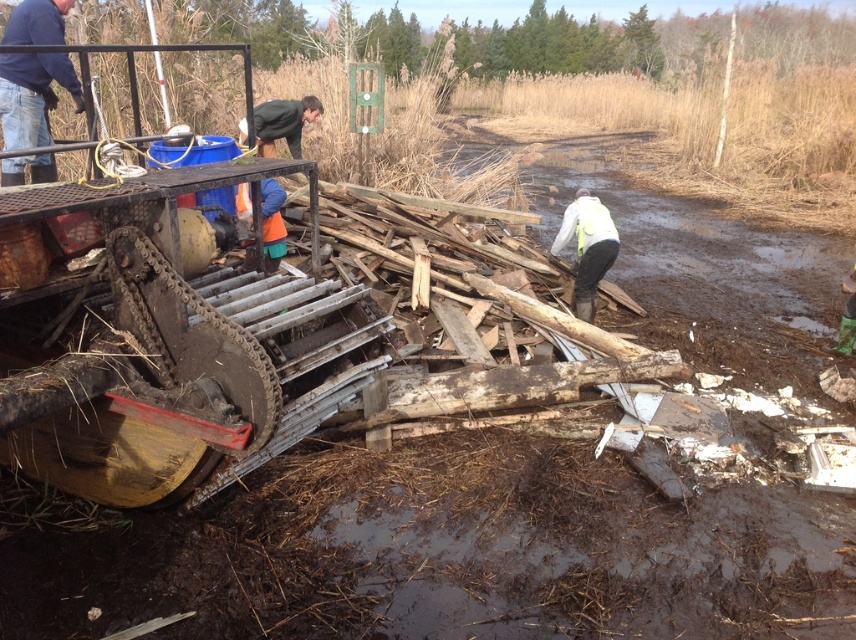
You are a worker in the area and need to hand a tool to the person wearing the white matte jacket at center. The tool you have is 10 feet long. Can you reach them from where you are standing next to the green matte jacket at upper center without moving?

The distance between the white matte jacket at center and green matte jacket at upper center is 10.11 feet. Since the tool is 10 feet long, it is slightly shorter than the distance between them, so you cannot reach the person without moving.

You are a safety inspector observing the scene. You notice the blue denim jeans at upper left and the green matte jacket at upper center. According to safety protocols, workers must avoid standing directly in front of others when operating machinery. Is there a potential safety hazard here?

Yes, there is a potential safety hazard because the blue denim jeans at upper left is in front of the green matte jacket at upper center, which violates the safety protocol of not standing directly in front of others when operating machinery.

You are standing at the position of the camera and looking at the two points in the scene. Which point, point (0, 72) or point (605, 218), is closer to you?

Point (0, 72) is closer to the camera than point (605, 218).